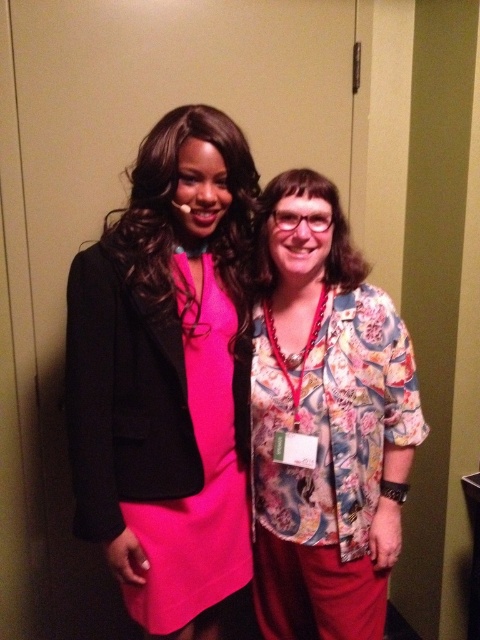
Who is positioned more to the right, matte pink dress at center or matte pink fabric dress at center?

From the viewer's perspective, matte pink fabric dress at center appears more on the right side.

Who is more forward, (231, 346) or (230, 304)?

Positioned in front is point (231, 346).

What do you see at coordinates (167, 374) in the screenshot? The image size is (480, 640). I see `matte pink dress at center` at bounding box center [167, 374].

Image resolution: width=480 pixels, height=640 pixels. I want to click on matte pink dress at center, so click(x=167, y=374).

Is point (184, 321) positioned after point (364, 518)?

No, it is not.

Does matte pink dress at center appear under floral-patterned blouse at right?

Incorrect, matte pink dress at center is not positioned below floral-patterned blouse at right.

Who is more forward, (x=136, y=355) or (x=373, y=556)?

Positioned in front is point (x=136, y=355).

The height and width of the screenshot is (640, 480). Identify the location of matte pink dress at center. (167, 374).

Is floral-patterned blouse at right to the right of matte pink fabric dress at center from the viewer's perspective?

Yes, floral-patterned blouse at right is to the right of matte pink fabric dress at center.

How far apart are floral-patterned blouse at right and matte pink fabric dress at center?

The distance of floral-patterned blouse at right from matte pink fabric dress at center is 7.57 inches.

Is point (285, 212) less distant than point (126, 595)?

Yes, point (285, 212) is closer to viewer.

Where is `floral-patterned blouse at right`? floral-patterned blouse at right is located at coordinates (324, 420).